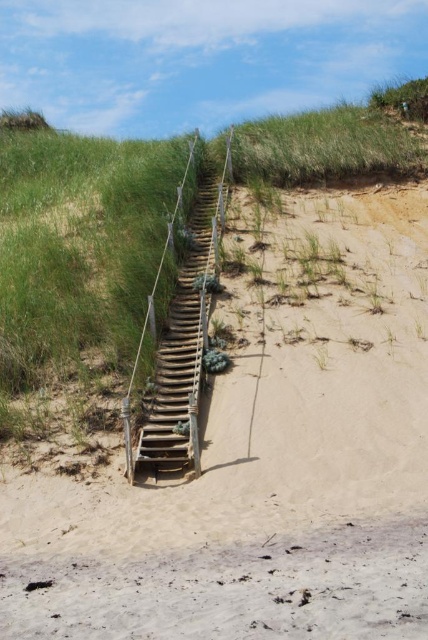
Question: Which of the following is the closest to the observer?

Choices:
 (A) (273, 609)
 (B) (208, 220)

Answer: (A)

Question: Can you confirm if light brown sandy stairs at center is wider than wooden stairs at center?

Choices:
 (A) no
 (B) yes

Answer: (B)

Question: Which object is closer to the camera taking this photo?

Choices:
 (A) light brown sandy stairs at center
 (B) wooden stairs at center

Answer: (A)

Question: Can you confirm if light brown sandy stairs at center is positioned to the left of wooden stairs at center?

Choices:
 (A) yes
 (B) no

Answer: (B)

Question: In this image, where is light brown sandy stairs at center located relative to wooden stairs at center?

Choices:
 (A) right
 (B) left

Answer: (A)

Question: Which object appears farthest from the camera in this image?

Choices:
 (A) light brown sandy stairs at center
 (B) wooden stairs at center

Answer: (B)